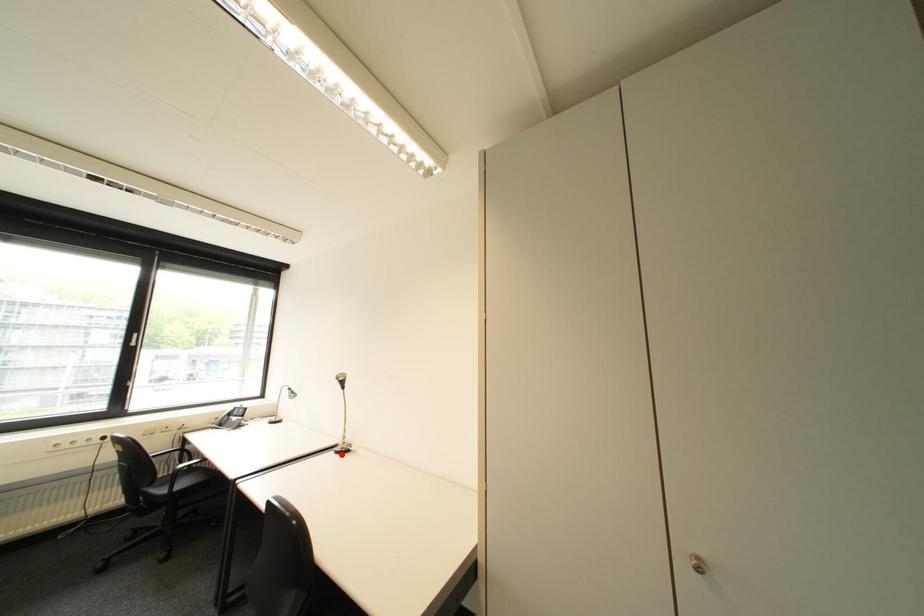
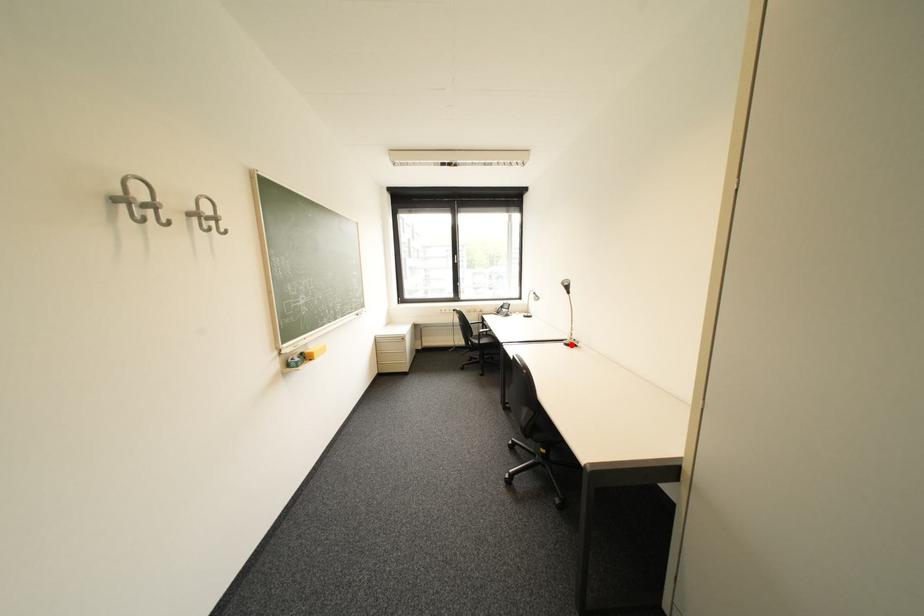
I am providing you with two images of the same scene from different viewpoints. A red point is marked on the first image and another point is marked on the second image. Is the marked point in image1 the same physical position as the marked point in image2?

Yes